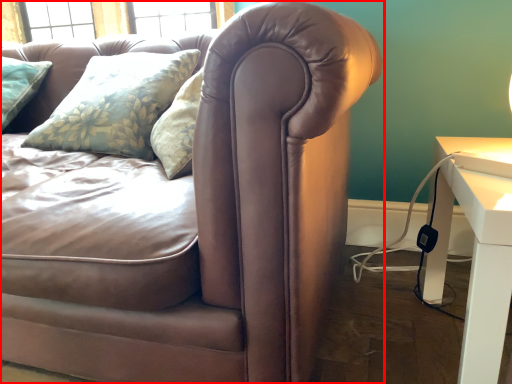
Question: From the image, what is the correct spatial relationship of studio couch (annotated by the red box) in relation to table?

Choices:
 (A) left
 (B) right

Answer: (A)